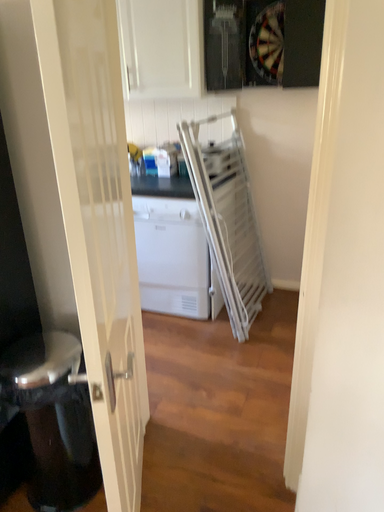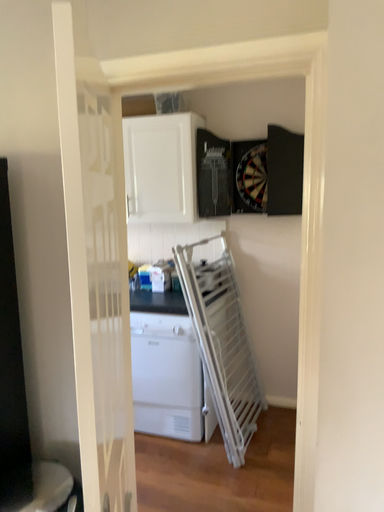
Question: Which way did the camera rotate in the video?

Choices:
 (A) rotated downward
 (B) rotated upward

Answer: (B)